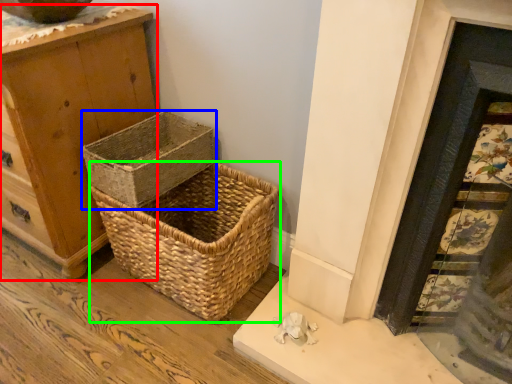
Question: Which is farther away from chest of drawers (highlighted by a red box)? picnic basket (highlighted by a blue box) or picnic basket (highlighted by a green box)?

Choices:
 (A) picnic basket
 (B) picnic basket

Answer: (B)